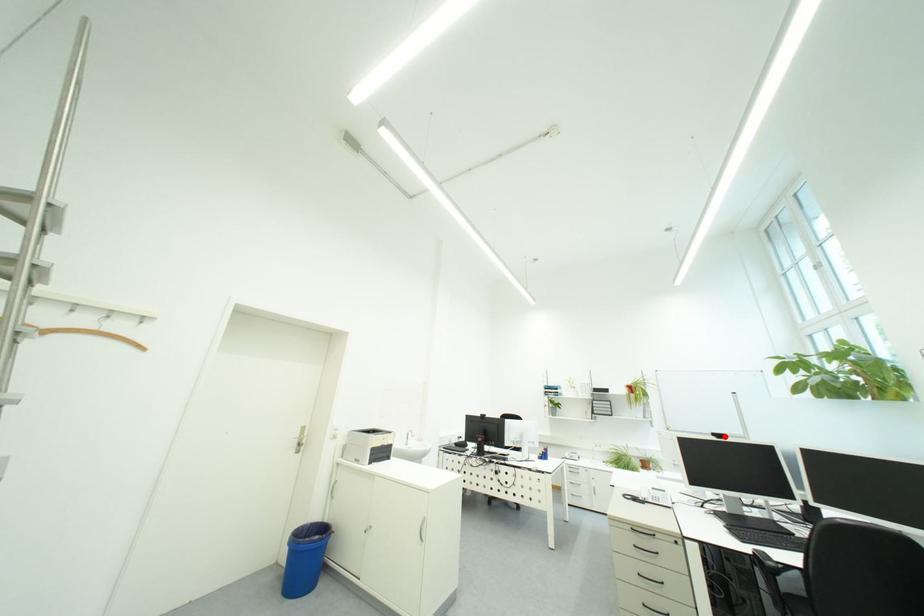
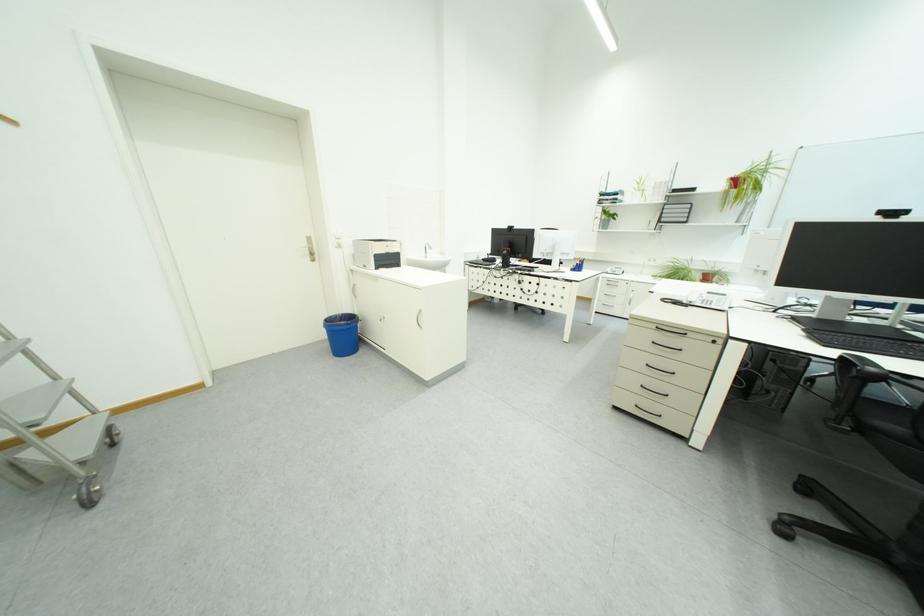
Where in the second image is the point corresponding to the highlighted location from the first image?

(893, 215)